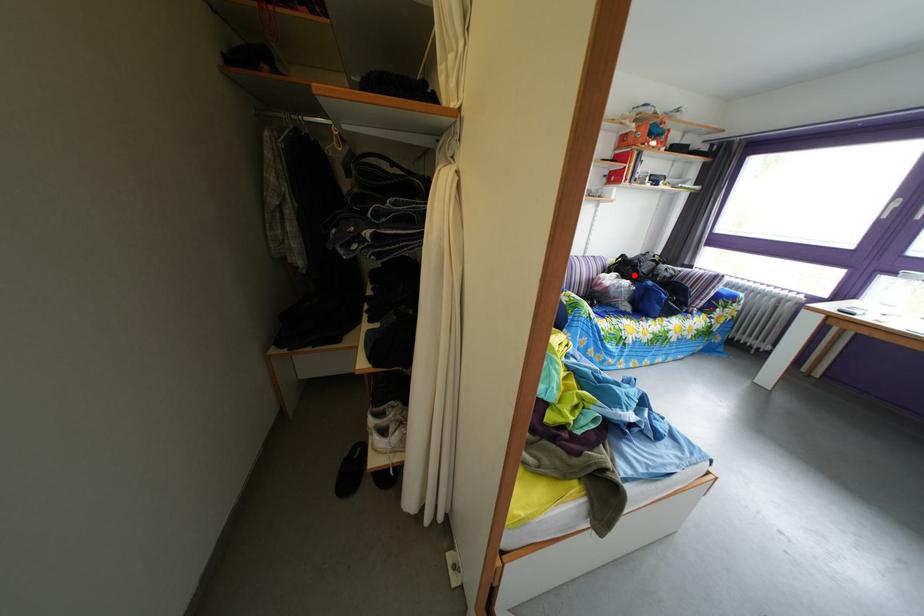
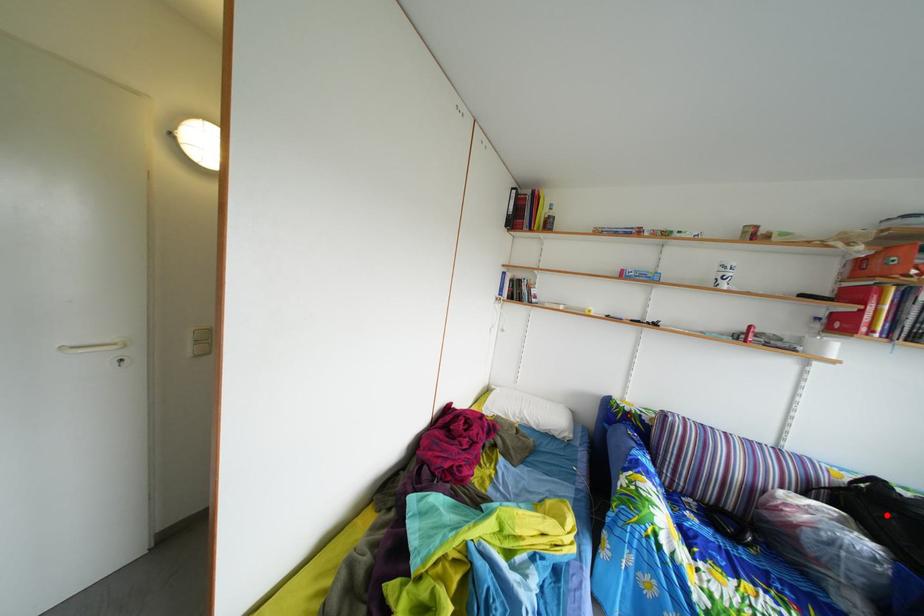
I am providing you with two images of the same scene from different viewpoints. A red point is marked on the first image and another point is marked on the second image. Is the marked point in image1 the same physical position as the marked point in image2?

Yes